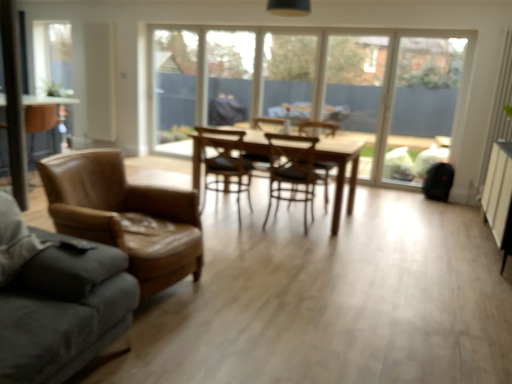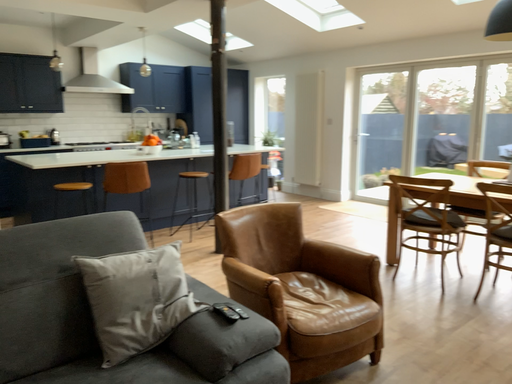
Question: How did the camera likely rotate when shooting the video?

Choices:
 (A) rotated left
 (B) rotated right

Answer: (A)